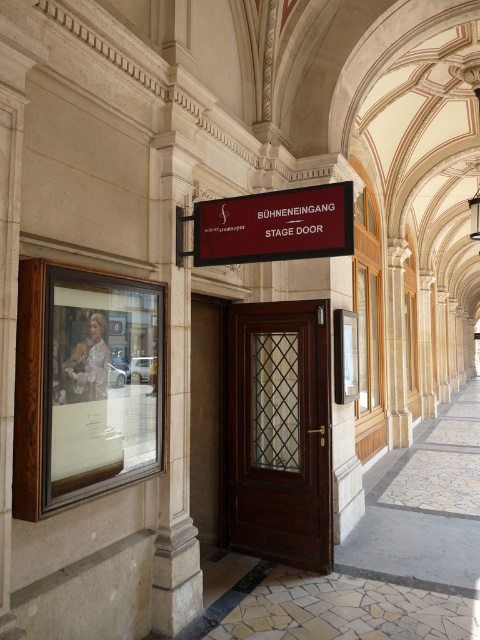
You are an actor arriving at the venue and need to locate the stage door. You see the dark wood door at center and the matte black sign at center. Which object is closer to you as you approach the entrance?

The dark wood door at center is closer to you than the matte black sign at center because it is further to the viewer.

You are an event organizer who needs to transport a large banner that is 1.2 meters wide. You see the dark wood door at center and the matte black sign at center. Which object has a width that allows the banner to pass through or under it?

The dark wood door at center has a width less than the matte black sign at center, so the banner cannot pass through the door. However, the matte black sign at center is wider, so the banner can pass under it if the sign is mounted high enough. But since the description only mentions width, the sign might be wide enough for the banner to fit under, assuming height clearance is sufficient.

You are an actor arriving for a performance and need to locate the stage door. You see the dark wood door at center and the matte black sign at center. Which object is to the left of the other?

The matte black sign at center is to the left of the dark wood door at center because the dark wood door at center is positioned on the right side of the matte black sign at center.